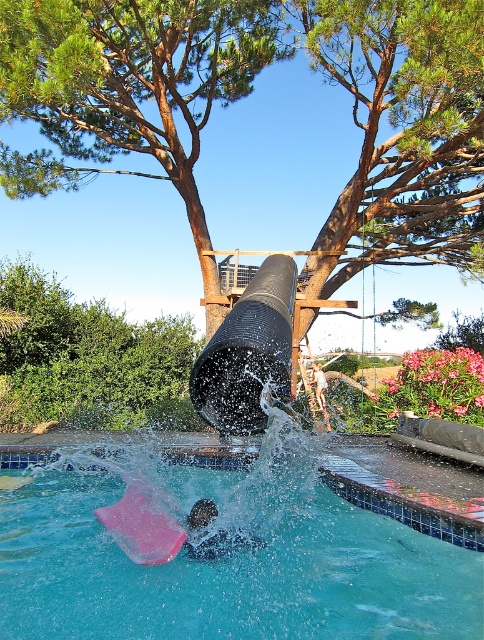
You are planning to take a photo of the green leafy tree at upper center and the pink rubber slide at lower center. Which object should you focus on first if you want to capture both in a single frame without moving the camera?

You should focus on the green leafy tree at upper center first because it is closer to the viewer than the pink rubber slide at lower center, ensuring both are in focus when using a single focal point.

You are standing at the edge of the transparent plastic pool at center and want to reach the dark matte swim cap at lower center. Which direction should you move to get closer to the swim cap?

Since the transparent plastic pool at center is closer to the viewer than the dark matte swim cap at lower center, you should move away from the pool towards the swim cap to get closer to it.

You are planning to install a new lighting system for the swimming pool. You have two options for the light fixtures. One is designed to be placed at the base of the green leafy tree at upper center, and the other is to be mounted on top of the pink rubber slide at lower center. Which location would allow the light to reach higher above the pool area?

The green leafy tree at upper center is taller than the pink rubber slide at lower center, so placing the light fixture at the base of the green leafy tree at upper center would allow it to reach higher above the pool area.